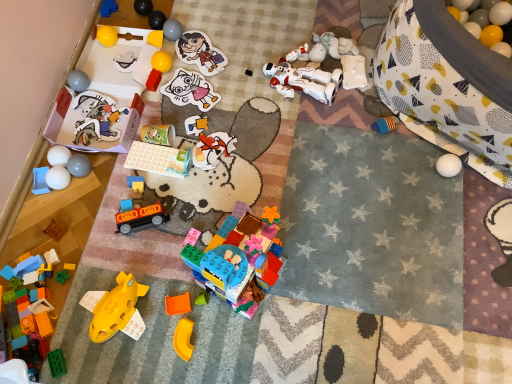
Question: From a real-world perspective, is yellow plastic arch at lower center, placed as the 27th toy when sorted from top to bottom, positioned under blue plastic tray at lower left, marked as the eighteenth toy in a top-to-bottom arrangement, based on gravity?

Choices:
 (A) no
 (B) yes

Answer: (A)

Question: Would you say yellow plastic arch at lower center, placed as the 27th toy when sorted from top to bottom, is a long distance from blue plastic tray at lower left, marked as the eighteenth toy in a top-to-bottom arrangement?

Choices:
 (A) yes
 (B) no

Answer: (B)

Question: Is yellow plastic arch at lower center, placed as the 27th toy when sorted from top to bottom, at the left side of blue plastic tray at lower left, placed as the 10th toy when sorted from bottom to top?

Choices:
 (A) no
 (B) yes

Answer: (A)

Question: Can you confirm if yellow plastic arch at lower center, placed as the 27th toy when sorted from top to bottom, is wider than blue plastic tray at lower left, marked as the eighteenth toy in a top-to-bottom arrangement?

Choices:
 (A) no
 (B) yes

Answer: (A)

Question: Is yellow plastic arch at lower center, which ranks as the 1th toy in bottom-to-top order, positioned with its back to blue plastic tray at lower left, marked as the eighteenth toy in a top-to-bottom arrangement?

Choices:
 (A) no
 (B) yes

Answer: (A)

Question: Visually, is translucent yellow plastic spaceship at lower left, the 24th toy when ordered from top to bottom, positioned to the left or to the right of black plastic toy at center, which is the 7th toy from top to bottom?

Choices:
 (A) left
 (B) right

Answer: (A)

Question: From the image's perspective, relative to black plastic toy at center, the 21th toy when ordered from bottom to top, is translucent yellow plastic spaceship at lower left, the 24th toy when ordered from top to bottom, above or below?

Choices:
 (A) below
 (B) above

Answer: (A)

Question: From a real-world perspective, is translucent yellow plastic spaceship at lower left, which appears as the 4th toy when ordered from the bottom, positioned above or below black plastic toy at center, which is the 7th toy from top to bottom?

Choices:
 (A) above
 (B) below

Answer: (B)

Question: Is point (56, 279) positioned closer to the camera than point (245, 71)?

Choices:
 (A) farther
 (B) closer

Answer: (B)

Question: Is point (245, 74) positioned closer to the camera than point (357, 74)?

Choices:
 (A) farther
 (B) closer

Answer: (A)

Question: Relative to white plastic robot at upper right, acting as the 8th toy starting from the top, is black plastic toy at center, the 21th toy when ordered from bottom to top, in front or behind?

Choices:
 (A) behind
 (B) front

Answer: (A)

Question: Looking at their shapes, would you say black plastic toy at center, the 21th toy when ordered from bottom to top, is wider or thinner than white plastic robot at upper right, acting as the 8th toy starting from the top?

Choices:
 (A) wide
 (B) thin

Answer: (B)

Question: Would you say black plastic toy at center, which is the 7th toy from top to bottom, is inside or outside white plastic robot at upper right, acting as the 8th toy starting from the top?

Choices:
 (A) outside
 (B) inside

Answer: (A)

Question: Considering the positions of translucent plastic blocks at lower left, positioned as the 23th toy in top-to-bottom order, and matte blue plastic toy at center, which is the nineteenth toy from top to bottom, in the image, is translucent plastic blocks at lower left, positioned as the 23th toy in top-to-bottom order, bigger or smaller than matte blue plastic toy at center, which is the nineteenth toy from top to bottom,?

Choices:
 (A) big
 (B) small

Answer: (A)

Question: Is translucent plastic blocks at lower left, positioned as the 23th toy in top-to-bottom order, inside the boundaries of matte blue plastic toy at center, which is the nineteenth toy from top to bottom, or outside?

Choices:
 (A) outside
 (B) inside

Answer: (A)